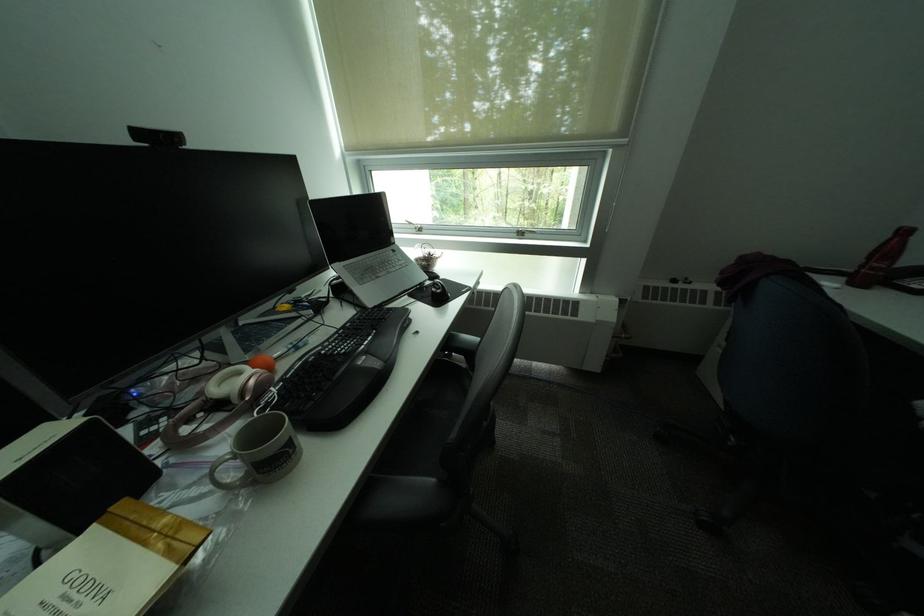
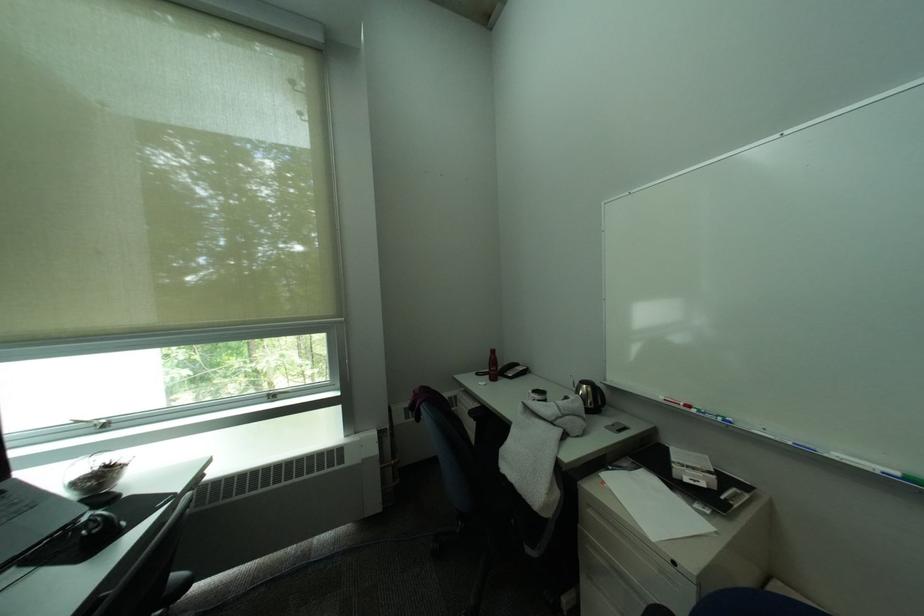
Locate, in the second image, the point that corresponds to point (427, 229) in the first image.

(106, 427)